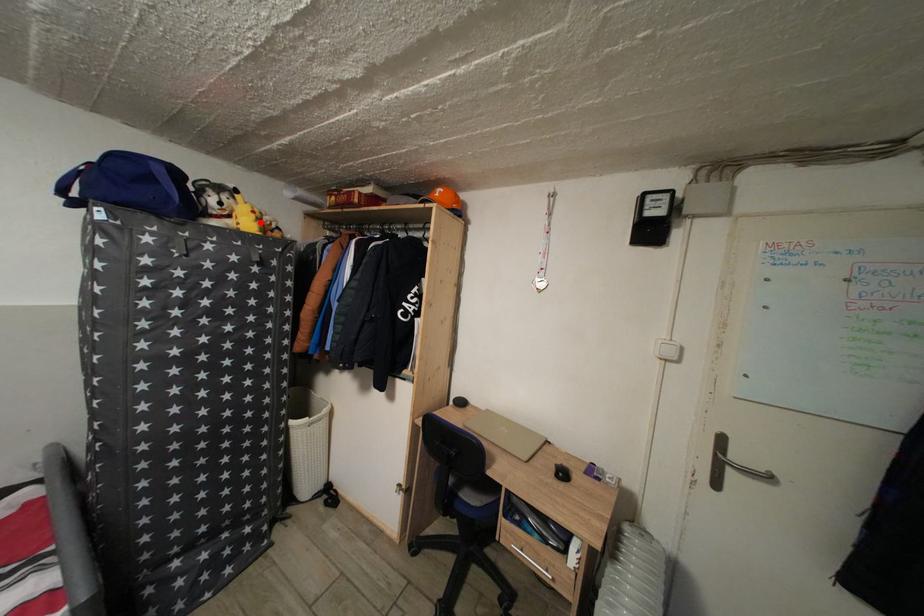
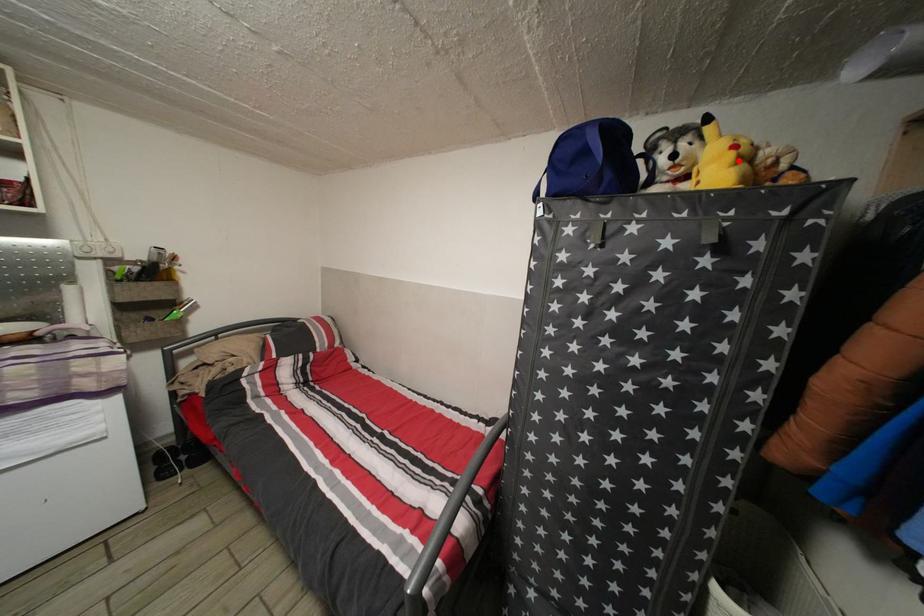
I am providing you with two images of the same scene from different viewpoints. A red point is marked on the first image and another point is marked on the second image. Is the marked point in image1 the same physical position as the marked point in image2?

Yes